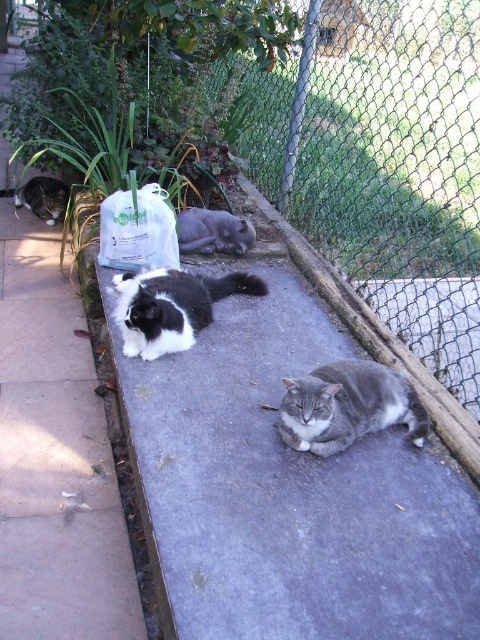
Who is shorter, gray fluffy cat at center or white smooth concrete at center?

Standing shorter between the two is gray fluffy cat at center.

The height and width of the screenshot is (640, 480). What do you see at coordinates (348, 406) in the screenshot?
I see `gray fluffy cat at center` at bounding box center [348, 406].

Locate an element on the screen. gray fluffy cat at center is located at coordinates (348, 406).

Can you confirm if gray fur cat at center is positioned above black and white fur cat at left?

No.

Is gray fur cat at center further to the viewer compared to black and white fur cat at left?

No, it is not.

Does point (189, 228) come closer to viewer compared to point (50, 186)?

That is True.

The height and width of the screenshot is (640, 480). I want to click on gray fur cat at center, so click(213, 230).

Is black and white fur cat at center to the right of black and white fur cat at left from the viewer's perspective?

Indeed, black and white fur cat at center is positioned on the right side of black and white fur cat at left.

Who is higher up, black and white fur cat at center or black and white fur cat at left?

black and white fur cat at left is higher up.

Does point (127, 292) come closer to viewer compared to point (24, 188)?

Yes, point (127, 292) is in front of point (24, 188).

At what (x,y) coordinates should I click in order to perform the action: click on black and white fur cat at center. Please return your answer as a coordinate pair (x, y). Looking at the image, I should click on (171, 307).